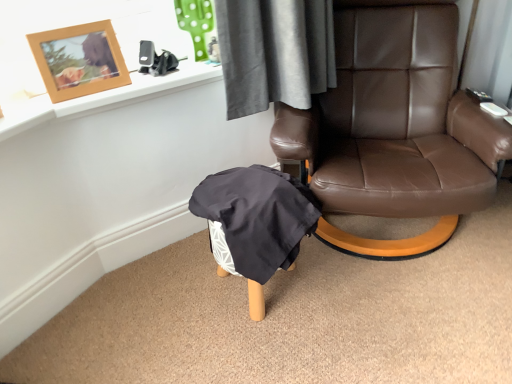
Image resolution: width=512 pixels, height=384 pixels. Describe the element at coordinates (257, 221) in the screenshot. I see `dark gray fabric bean bag chair at lower center` at that location.

This screenshot has height=384, width=512. I want to click on dark gray fabric bean bag chair at lower center, so click(x=257, y=221).

At what (x,y) coordinates should I click in order to perform the action: click on black plastic remote control at upper right, the first remote control in the back-to-front sequence. Please return your answer as a coordinate pair (x, y). Image resolution: width=512 pixels, height=384 pixels. Looking at the image, I should click on (478, 95).

This screenshot has height=384, width=512. Find the location of `woodenobject at upper left`. woodenobject at upper left is located at coordinates pos(79,60).

Is the position of black plastic remote control at upper right, which appears as the 2th remote control when viewed from the front, less distant than that of brown leather chair at center?

That is False.

Looking at this image, can you tell me how much black plastic remote control at upper right, which appears as the 2th remote control when viewed from the front, and brown leather chair at center differ in facing direction?

black plastic remote control at upper right, which appears as the 2th remote control when viewed from the front, and brown leather chair at center are facing 4.12 degrees away from each other.

From the image's perspective, does black plastic remote control at upper right, acting as the 2th remote control starting from the bottom, appear lower than brown leather chair at center?

Actually, black plastic remote control at upper right, acting as the 2th remote control starting from the bottom, appears above brown leather chair at center in the image.

Can you confirm if black plastic remote control at upper right, which appears as the 2th remote control when viewed from the front, is smaller than brown leather chair at center?

Correct, black plastic remote control at upper right, which appears as the 2th remote control when viewed from the front, occupies less space than brown leather chair at center.

Is brown leather chair at center smaller than black plastic remote control at upper right, the first remote control in the back-to-front sequence?

No.

Which point is more forward, (438, 234) or (486, 98)?

The point (438, 234) is in front.

From the picture: From the image's perspective, does brown leather chair at center appear lower than black plastic remote control at upper right, acting as the 2th remote control starting from the bottom?

Correct, brown leather chair at center appears lower than black plastic remote control at upper right, acting as the 2th remote control starting from the bottom, in the image.

Which of these two, brown leather chair at center or black plastic remote control at upper right, the first remote control in the back-to-front sequence, is thinner?

black plastic remote control at upper right, the first remote control in the back-to-front sequence, is thinner.

From the image's perspective, which object appears higher, dark gray fabric bean bag chair at lower center or black plastic remote control at upper right, the first remote control in the back-to-front sequence?

From the image's view, black plastic remote control at upper right, the first remote control in the back-to-front sequence, is above.

Is dark gray fabric bean bag chair at lower center touching black plastic remote control at upper right, acting as the 2th remote control starting from the bottom?

No, dark gray fabric bean bag chair at lower center is not making contact with black plastic remote control at upper right, acting as the 2th remote control starting from the bottom.

Considering the points (262, 174) and (470, 91), which point is behind, point (262, 174) or point (470, 91)?

Point (470, 91)

From the picture: Is dark gray fabric bean bag chair at lower center in front of or behind black plastic remote control at upper right, the first remote control in the top-to-bottom sequence, in the image?

Visually, dark gray fabric bean bag chair at lower center is located in front of black plastic remote control at upper right, the first remote control in the top-to-bottom sequence.

Can you confirm if brown leather chair at center is wider than dark gray fabric bean bag chair at lower center?

Indeed, brown leather chair at center has a greater width compared to dark gray fabric bean bag chair at lower center.

The image size is (512, 384). Find the location of `chair above the dark gray fabric bean bag chair at lower center (from the image's perspective)`. chair above the dark gray fabric bean bag chair at lower center (from the image's perspective) is located at coordinates (394, 128).

Can you confirm if brown leather chair at center is positioned to the right of dark gray fabric bean bag chair at lower center?

Yes.

Could you tell me if brown leather chair at center is facing dark gray fabric bean bag chair at lower center?

No, brown leather chair at center is not oriented towards dark gray fabric bean bag chair at lower center.

Considering the sizes of black plastic remote control at upper right, acting as the 2th remote control starting from the bottom, and woodenobject at upper left in the image, is black plastic remote control at upper right, acting as the 2th remote control starting from the bottom, bigger or smaller than woodenobject at upper left?

black plastic remote control at upper right, acting as the 2th remote control starting from the bottom, is smaller than woodenobject at upper left.

Is black plastic remote control at upper right, the first remote control in the back-to-front sequence, spatially inside woodenobject at upper left, or outside of it?

black plastic remote control at upper right, the first remote control in the back-to-front sequence, lies outside woodenobject at upper left.

Image resolution: width=512 pixels, height=384 pixels. What are the coordinates of `picture frame that is above the black plastic remote control at upper right, which appears as the 2th remote control when viewed from the front (from a real-world perspective)` in the screenshot? It's located at (79, 60).

Can you confirm if black plastic remote control at upper right, the first remote control in the back-to-front sequence, is positioned to the left of woodenobject at upper left?

Incorrect, black plastic remote control at upper right, the first remote control in the back-to-front sequence, is not on the left side of woodenobject at upper left.

Could you tell me if black plastic remote control at upper right, acting as the 2th remote control starting from the back, is facing brown leather chair at center?

Yes, black plastic remote control at upper right, acting as the 2th remote control starting from the back, is oriented towards brown leather chair at center.

Considering the relative positions of black plastic remote control at upper right, acting as the 2th remote control starting from the back, and brown leather chair at center in the image provided, is black plastic remote control at upper right, acting as the 2th remote control starting from the back, to the left or to the right of brown leather chair at center?

In the image, black plastic remote control at upper right, acting as the 2th remote control starting from the back, appears on the right side of brown leather chair at center.

Does point (488, 110) lie in front of point (425, 145)?

That is True.

Consider the image. Measure the distance from black plastic remote control at upper right, the 1th remote control from the bottom, to brown leather chair at center.

black plastic remote control at upper right, the 1th remote control from the bottom, is 14.37 inches from brown leather chair at center.

Is black plastic remote control at upper right, the first remote control in the top-to-bottom sequence, located outside black plastic remote control at upper right, the 1th remote control from the bottom?

Yes, black plastic remote control at upper right, the first remote control in the top-to-bottom sequence, is not within black plastic remote control at upper right, the 1th remote control from the bottom.

Would you say black plastic remote control at upper right, the first remote control in the top-to-bottom sequence, is to the left or to the right of black plastic remote control at upper right, acting as the 2th remote control starting from the back, in the picture?

Based on their positions, black plastic remote control at upper right, the first remote control in the top-to-bottom sequence, is located to the right of black plastic remote control at upper right, acting as the 2th remote control starting from the back.

Considering the relative positions of black plastic remote control at upper right, which appears as the 2th remote control when viewed from the front, and black plastic remote control at upper right, acting as the 2th remote control starting from the back, in the image provided, is black plastic remote control at upper right, which appears as the 2th remote control when viewed from the front, in front of black plastic remote control at upper right, acting as the 2th remote control starting from the back,?

No, the depth of black plastic remote control at upper right, which appears as the 2th remote control when viewed from the front, is greater than that of black plastic remote control at upper right, acting as the 2th remote control starting from the back.

Between black plastic remote control at upper right, the first remote control in the back-to-front sequence, and black plastic remote control at upper right, the 1th remote control from the bottom, which one has smaller width?

Thinner between the two is black plastic remote control at upper right, the 1th remote control from the bottom.

Where is `remote control that is the 1st object above the brown leather chair at center (from a real-world perspective)`? The height and width of the screenshot is (384, 512). remote control that is the 1st object above the brown leather chair at center (from a real-world perspective) is located at coordinates (478, 95).

This screenshot has width=512, height=384. What are the coordinates of `chair on the left of black plastic remote control at upper right, which appears as the 2th remote control when viewed from the front` in the screenshot? It's located at (394, 128).

Looking at the image, which one is located further to brown leather chair at center, woodenobject at upper left or dark gray fabric bean bag chair at lower center?

woodenobject at upper left is positioned further to the anchor brown leather chair at center.

Considering their positions, is black plastic remote control at upper right, the first remote control in the top-to-bottom sequence, positioned further to dark gray fabric bean bag chair at lower center than black plastic remote control at upper right, acting as the 2th remote control starting from the back?

black plastic remote control at upper right, the first remote control in the top-to-bottom sequence, is further to dark gray fabric bean bag chair at lower center.

Based on their spatial positions, is black plastic remote control at upper right, arranged as the second remote control when viewed from the top, or woodenobject at upper left further from brown leather chair at center?

The object further to brown leather chair at center is woodenobject at upper left.

Estimate the real-world distances between objects in this image. Which object is further from woodenobject at upper left, brown leather chair at center or black plastic remote control at upper right, the first remote control in the top-to-bottom sequence?

black plastic remote control at upper right, the first remote control in the top-to-bottom sequence, lies further to woodenobject at upper left than the other object.

Considering their positions, is black plastic remote control at upper right, acting as the 2th remote control starting from the back, positioned closer to dark gray fabric bean bag chair at lower center than woodenobject at upper left?

The object closer to dark gray fabric bean bag chair at lower center is woodenobject at upper left.

Estimate the real-world distances between objects in this image. Which object is closer to woodenobject at upper left, dark gray fabric bean bag chair at lower center or brown leather chair at center?

dark gray fabric bean bag chair at lower center is positioned closer to the anchor woodenobject at upper left.

From the image, which object appears to be nearer to brown leather chair at center, black plastic remote control at upper right, the 1th remote control from the front, or black plastic remote control at upper right, the first remote control in the back-to-front sequence?

The object closer to brown leather chair at center is black plastic remote control at upper right, the 1th remote control from the front.

Looking at the image, which one is located further to brown leather chair at center, woodenobject at upper left or black plastic remote control at upper right, the first remote control in the top-to-bottom sequence?

Among the two, woodenobject at upper left is located further to brown leather chair at center.

Identify the location of chair located between dark gray fabric bean bag chair at lower center and black plastic remote control at upper right, acting as the 2th remote control starting from the back, in the left-right direction. This screenshot has height=384, width=512. [x=394, y=128].

Locate an element on the screen. The height and width of the screenshot is (384, 512). chair between dark gray fabric bean bag chair at lower center and black plastic remote control at upper right, which appears as the 2th remote control when viewed from the front, from left to right is located at coordinates (394, 128).

At what (x,y) coordinates should I click in order to perform the action: click on remote control between woodenobject at upper left and black plastic remote control at upper right, which appears as the 2th remote control when viewed from the front, from left to right. Please return your answer as a coordinate pair (x, y). The height and width of the screenshot is (384, 512). Looking at the image, I should click on (493, 109).

Image resolution: width=512 pixels, height=384 pixels. I want to click on bean bag chair between woodenobject at upper left and black plastic remote control at upper right, acting as the 2th remote control starting from the back, from left to right, so click(x=257, y=221).